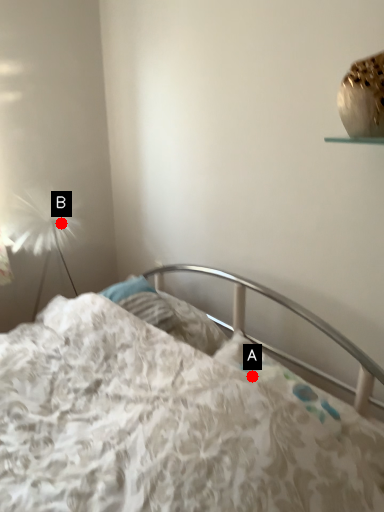
Question: Two points are circled on the image, labeled by A and B beside each circle. Which point is closer to the camera?

Choices:
 (A) A is closer
 (B) B is closer

Answer: (A)